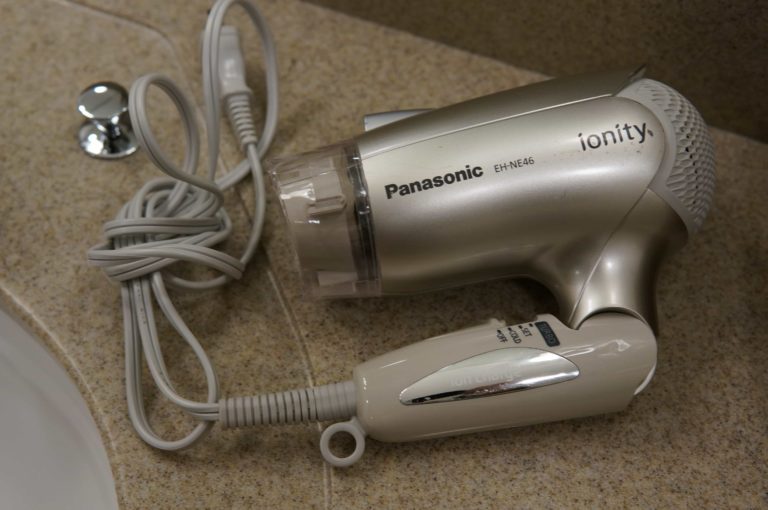
Find the location of a particular element. off switch is located at coordinates [500, 340].